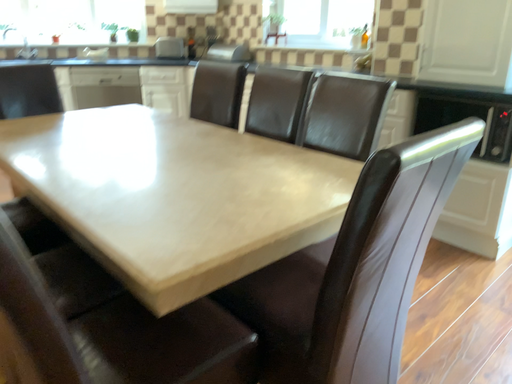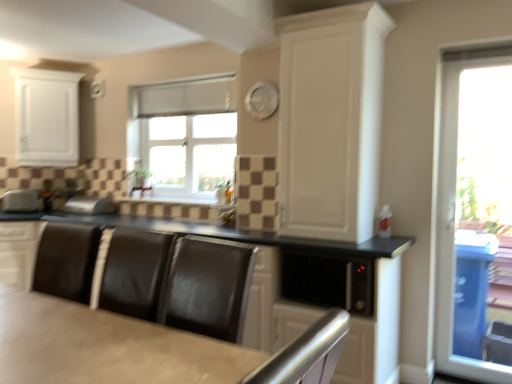
Question: How did the camera likely rotate when shooting the video?

Choices:
 (A) rotated right
 (B) rotated left

Answer: (A)